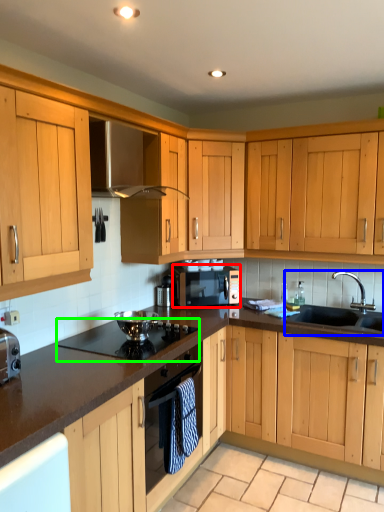
Question: Which is nearer to the microwave oven (highlighted by a red box)? sink (highlighted by a blue box) or gas stove (highlighted by a green box).

Choices:
 (A) sink
 (B) gas stove

Answer: (B)